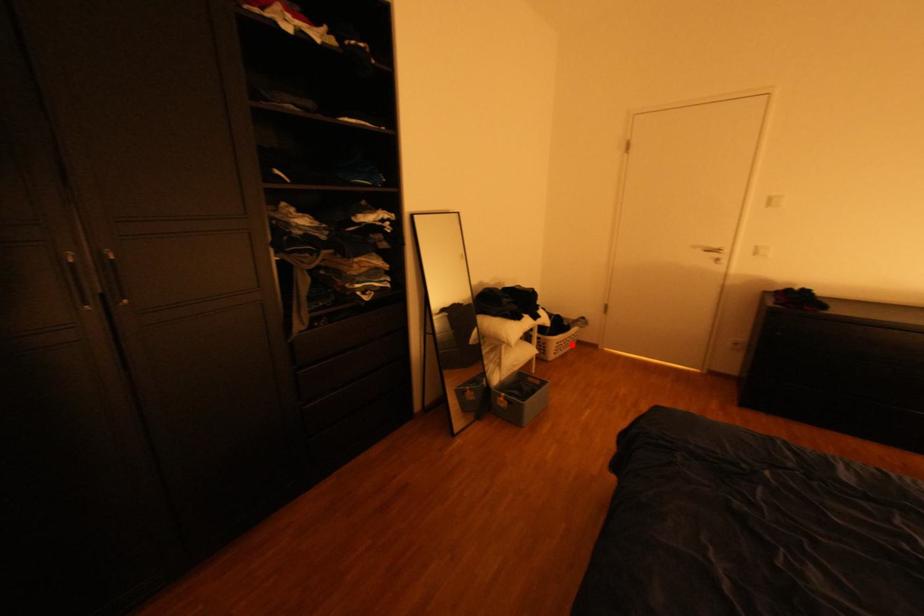
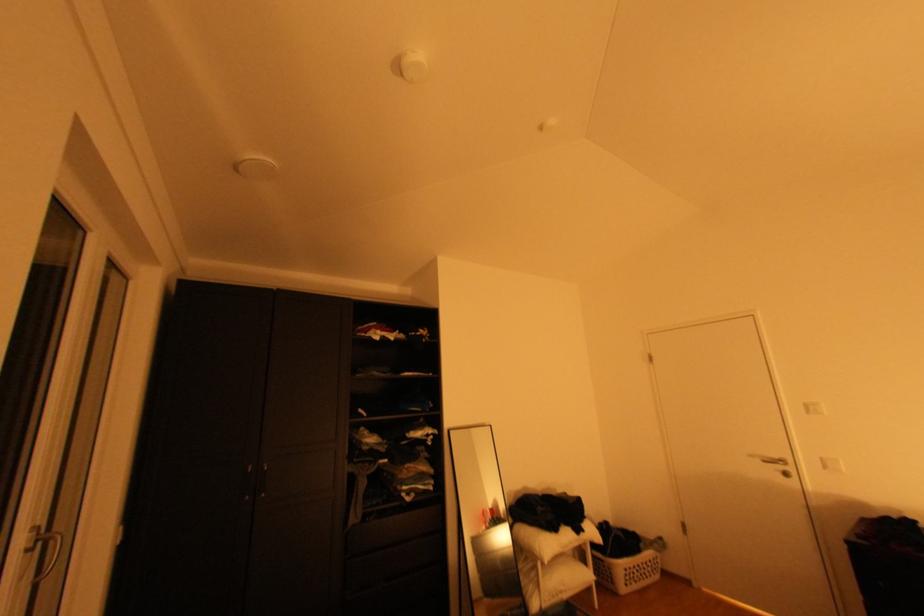
Where in the second image is the point corresponding to the highlighted location from the first image?

(642, 573)